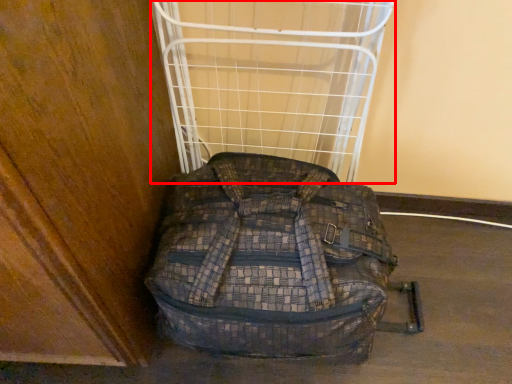
Question: From the image's perspective, considering the relative positions of cage (annotated by the red box) and backpack in the image provided, where is cage (annotated by the red box) located with respect to the staircase?

Choices:
 (A) below
 (B) above

Answer: (B)